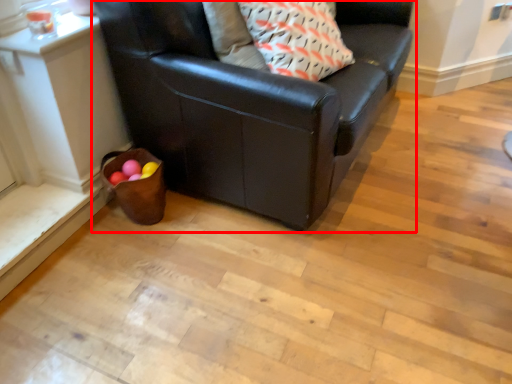
Question: From the image's perspective, where is studio couch (annotated by the red box) located in relation to throw pillow in the image?

Choices:
 (A) below
 (B) above

Answer: (B)